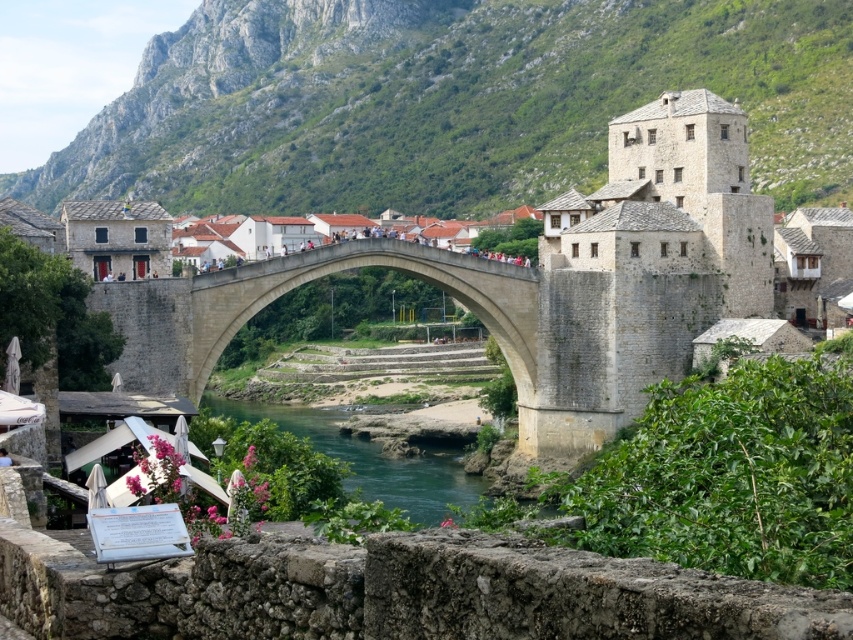
You are an architect planning to build a new observation deck. You want to ensure it has the best view of both the green stone mountain at upper center and the green stone river at center. Based on their heights, which object should be placed closer to the deck to ensure both are visible?

The green stone mountain at upper center is taller than the green stone river at center. To ensure both are visible from the observation deck, place the deck closer to the green stone river at center so that the taller mountain doesn not block the view of the river.

Based on the photo, you are an architect analyzing the composition of the image. Which object takes up more area in the scene between the stone arch bridge at center and the green stone river at center?

The green stone river at center occupies more space than the stone arch bridge at center, as stated in the description.

You are standing at the base of the historic stone bridge and want to reach the point marked as point (x=167, y=38). If your walking speed is 1.5 meters per second, how many seconds will it take you to reach that point?

The point (x=167, y=38) is 395.71 meters away from the viewer. At a walking speed of 1.5 meters per second, it would take approximately 263.8 seconds to reach the point.